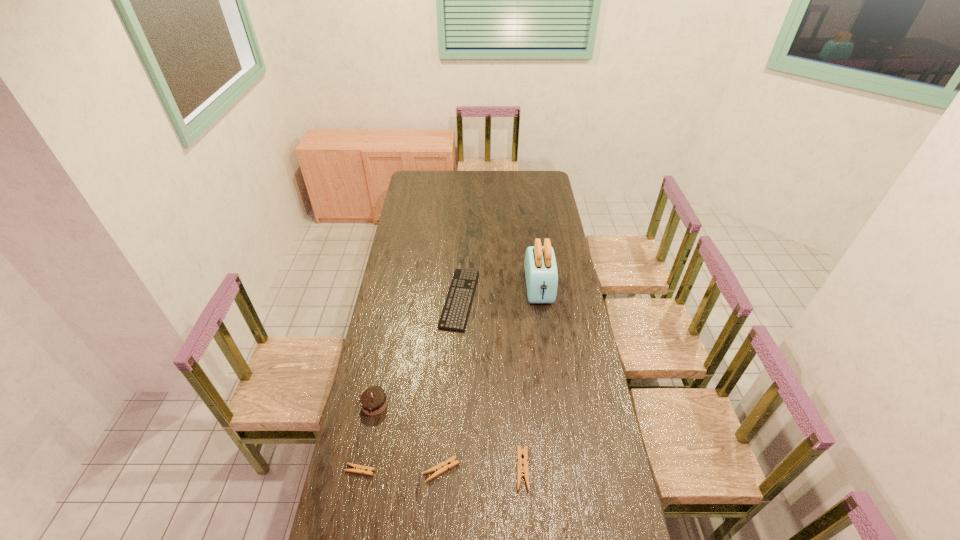
Locate an element on the screen. The image size is (960, 540). vacant region located 0.100m on the back of the second tallest clothespin is located at coordinates (444, 430).

The image size is (960, 540). Find the location of `free spot located 0.180m on the back of the rightmost clothespin`. free spot located 0.180m on the back of the rightmost clothespin is located at coordinates (517, 402).

Locate an element on the screen. The image size is (960, 540). free space located 0.330m on the front of the computer keyboard is located at coordinates (455, 399).

Where is `vacant area situated on the side of the toaster with the lever`? The height and width of the screenshot is (540, 960). vacant area situated on the side of the toaster with the lever is located at coordinates (552, 380).

Identify the location of vacant space located 0.160m on the right of the second tallest object. (429, 404).

Locate an element on the screen. The image size is (960, 540). clothespin present at the left edge is located at coordinates (360, 469).

Identify the location of chocolate cake at the left edge. (373, 400).

In order to click on object that is positioned at the right edge in this screenshot , I will do `click(541, 272)`.

In the image, there is a desktop. Identify the location of vacant space at the far edge. (503, 171).

Locate an element on the screen. This screenshot has width=960, height=540. vacant space at the left edge is located at coordinates (419, 192).